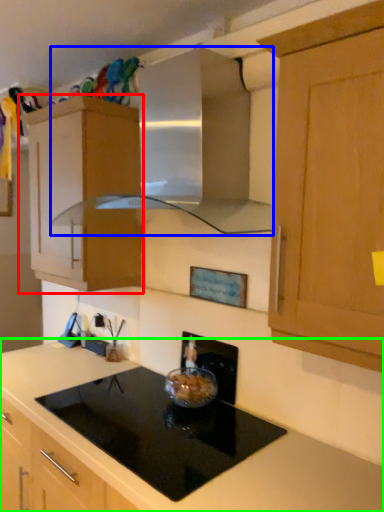
Question: Which object is the closest to the cabinetry (highlighted by a red box)? Choose among these: vent (highlighted by a blue box) or countertop (highlighted by a green box).

Choices:
 (A) vent
 (B) countertop

Answer: (A)